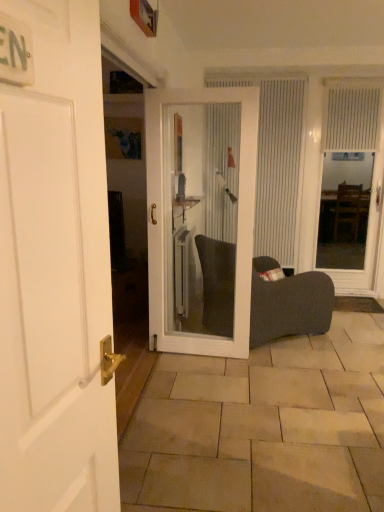
Question: Is white matte door at left, the second door positioned from the back, thinner than white textured curtain at upper right, the 1th curtain viewed from the right?

Choices:
 (A) no
 (B) yes

Answer: (B)

Question: Considering the relative sizes of white matte door at left, which is counted as the 1th door, starting from the front, and white textured curtain at upper right, which is the 2th curtain from left to right, in the image provided, is white matte door at left, which is counted as the 1th door, starting from the front, bigger than white textured curtain at upper right, which is the 2th curtain from left to right,?

Choices:
 (A) no
 (B) yes

Answer: (B)

Question: Is white matte door at left, the second door positioned from the back, shorter than white textured curtain at upper right, the 1th curtain viewed from the right?

Choices:
 (A) yes
 (B) no

Answer: (B)

Question: Considering the relative sizes of white matte door at left, which is counted as the 1th door, starting from the front, and white textured curtain at upper right, which is the 2th curtain from left to right, in the image provided, is white matte door at left, which is counted as the 1th door, starting from the front, wider than white textured curtain at upper right, which is the 2th curtain from left to right,?

Choices:
 (A) no
 (B) yes

Answer: (A)

Question: Is white matte door at left, the second door positioned from the back, far from white textured curtain at upper right, the 1th curtain viewed from the right?

Choices:
 (A) no
 (B) yes

Answer: (B)

Question: Is beige stone tile at lower center taller or shorter than white vertical blinds at center, which appears as the 2th curtain when viewed from the right?

Choices:
 (A) short
 (B) tall

Answer: (A)

Question: From the image's perspective, is beige stone tile at lower center located above or below white vertical blinds at center, which appears as the 2th curtain when viewed from the right?

Choices:
 (A) above
 (B) below

Answer: (B)

Question: Does point (326, 373) appear closer or farther from the camera than point (210, 211)?

Choices:
 (A) farther
 (B) closer

Answer: (B)

Question: From a real-world perspective, relative to white vertical blinds at center, which appears as the first curtain when viewed from the left, is beige stone tile at lower center vertically above or below?

Choices:
 (A) below
 (B) above

Answer: (A)

Question: Is white matte door at left, the second door positioned from the back, inside or outside of transparent glass door at right?

Choices:
 (A) outside
 (B) inside

Answer: (A)

Question: Relative to transparent glass door at right, is white matte door at left, the second door positioned from the back, in front or behind?

Choices:
 (A) behind
 (B) front

Answer: (B)

Question: Based on their positions, is white matte door at left, the second door positioned from the back, located to the left or right of transparent glass door at right?

Choices:
 (A) right
 (B) left

Answer: (B)

Question: Considering the positions of white matte door at left, which is counted as the 1th door, starting from the front, and transparent glass door at right in the image, is white matte door at left, which is counted as the 1th door, starting from the front, bigger or smaller than transparent glass door at right?

Choices:
 (A) big
 (B) small

Answer: (B)

Question: Considering the positions of dark fabric chair at center and white matte door at left, the second door positioned from the back, in the image, is dark fabric chair at center taller or shorter than white matte door at left, the second door positioned from the back,?

Choices:
 (A) short
 (B) tall

Answer: (A)

Question: Is point (256, 290) positioned closer to the camera than point (99, 373)?

Choices:
 (A) farther
 (B) closer

Answer: (A)